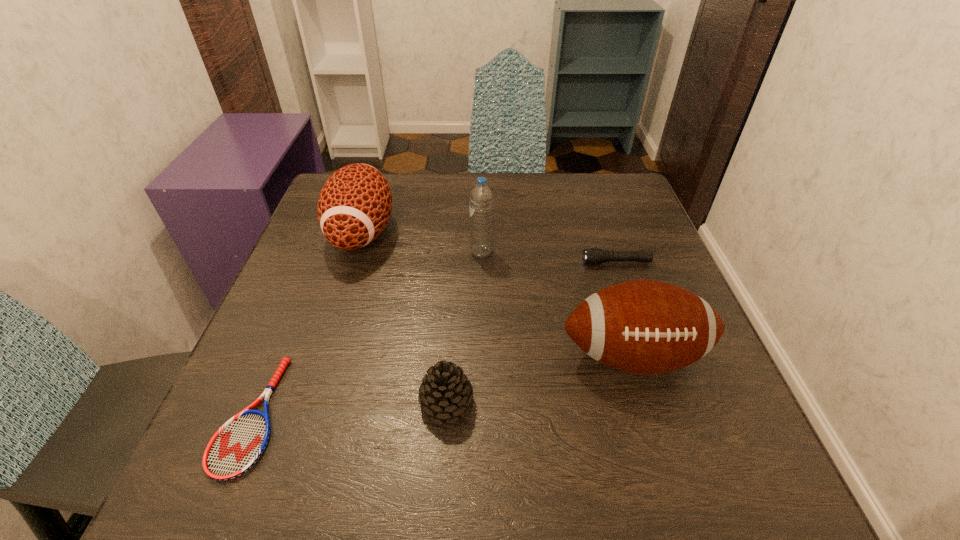
Find the location of a particular element. object present at the far left corner is located at coordinates (354, 206).

Identify the location of object that is positioned at the near left corner. (238, 444).

The height and width of the screenshot is (540, 960). Identify the location of free space at the far edge. (x=454, y=183).

In the image, there is a desktop. Where is `vacant space at the near edge`? vacant space at the near edge is located at coordinates (410, 487).

Image resolution: width=960 pixels, height=540 pixels. I want to click on blank space at the left edge of the desktop, so click(238, 394).

At what (x,y) coordinates should I click in order to perform the action: click on vacant space at the right edge of the desktop. Please return your answer as a coordinate pair (x, y). Image resolution: width=960 pixels, height=540 pixels. Looking at the image, I should click on [621, 241].

I want to click on free location at the far right corner of the desktop, so click(x=632, y=213).

The image size is (960, 540). I want to click on blank region between the shortest object and the pinecone, so click(x=349, y=409).

This screenshot has width=960, height=540. In order to click on free space between the flashlight and the tallest object in this screenshot , I will do `click(549, 258)`.

The height and width of the screenshot is (540, 960). What are the coordinates of `free space between the left football and the nearer football` in the screenshot? It's located at (497, 294).